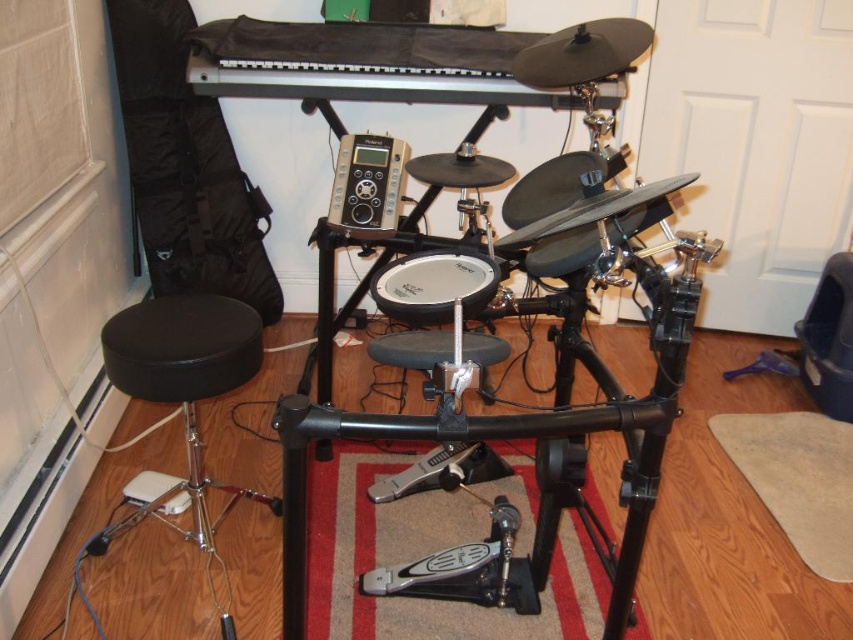
You are setting up a microphone stand for recording your drumming session. The microphone stand needs to be placed exactly halfway between the black leather stool at lower left and the electronic drum kit. Given the coordinates from the scene description, where should you position the microphone stand?

The black leather stool at lower left is located at point (181, 388). To find the midpoint between it and the electronic drum kit, you would average the coordinates. However, the exact coordinates of the drum kit aren not provided. Without this information, the precise midpoint cannot be calculated.

You are setting up a drumming station and need to place the white matte drum at center and the silver metallic speaker at center. According to the image, which object is positioned to the right of the other?

The white matte drum at center is to the right of the silver metallic speaker at center.